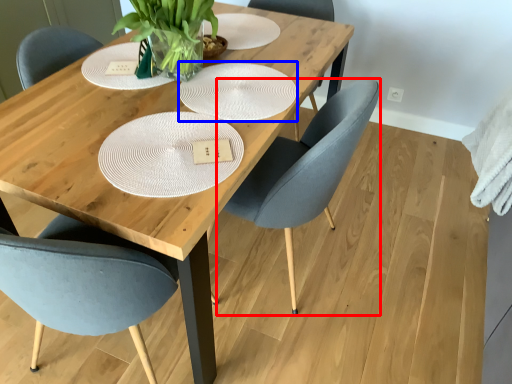
Question: Among these objects, which one is nearest to the camera, chair (highlighted by a red box) or plate (highlighted by a blue box)?

Choices:
 (A) chair
 (B) plate

Answer: (A)